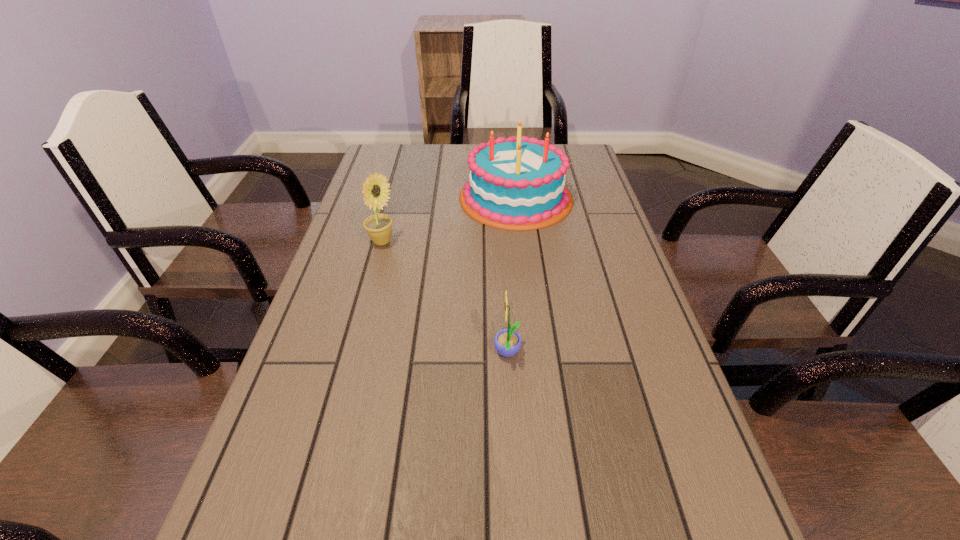
This screenshot has width=960, height=540. In order to click on birthday cake in this screenshot , I will do `click(518, 184)`.

What are the coordinates of `the second farthest object` in the screenshot? It's located at point(378,226).

Find the location of a particular element. Image resolution: width=960 pixels, height=540 pixels. the taller sunflower is located at coordinates (378, 226).

Identify the location of the right sunflower. This screenshot has width=960, height=540. (507, 342).

Find the location of `the shorter sunflower`. the shorter sunflower is located at coordinates (507, 342).

The image size is (960, 540). What are the coordinates of `vacant region located 0.180m on the back of the birthday cake` in the screenshot? It's located at (510, 146).

Where is `free space located 0.300m on the face of the taller sunflower`? free space located 0.300m on the face of the taller sunflower is located at coordinates (510, 242).

Locate an element on the screen. The height and width of the screenshot is (540, 960). vacant position located on the front-facing side of the shortest object is located at coordinates (435, 354).

The width and height of the screenshot is (960, 540). In order to click on vacant region located 0.250m on the front-facing side of the shortest object in this screenshot , I will do `click(371, 354)`.

You are a GUI agent. You are given a task and a screenshot of the screen. Output one action in this format:
    pyautogui.click(x=<x>, y=<y>)
    Task: Click on the free region located 0.360m on the front-facing side of the shortest object
    
    Given the screenshot: What is the action you would take?
    pyautogui.click(x=317, y=354)